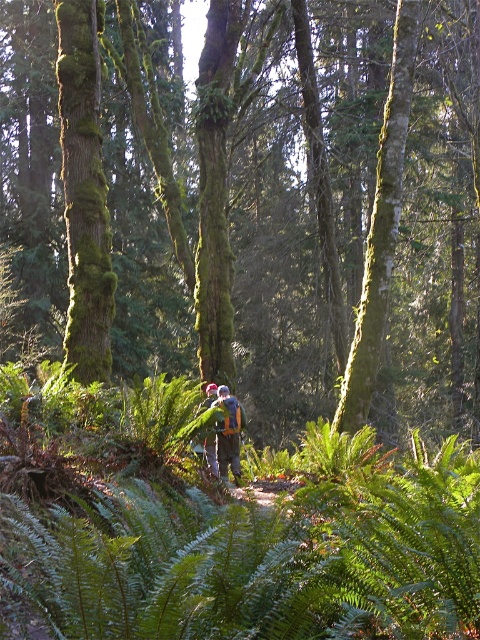
Question: Which point is farther to the camera?

Choices:
 (A) camouflage fabric backpack at center
 (B) green mossy tree at center

Answer: (A)

Question: Is green mossy tree at center wider than camouflage fabric backpack at center?

Choices:
 (A) no
 (B) yes

Answer: (B)

Question: Does green mossy tree at center lie behind camouflage fabric backpack at center?

Choices:
 (A) no
 (B) yes

Answer: (A)

Question: Is green mossy tree at center positioned in front of camouflage fabric backpack at center?

Choices:
 (A) yes
 (B) no

Answer: (A)

Question: Among these points, which one is farthest from the camera?

Choices:
 (A) (21, 108)
 (B) (218, 458)

Answer: (A)